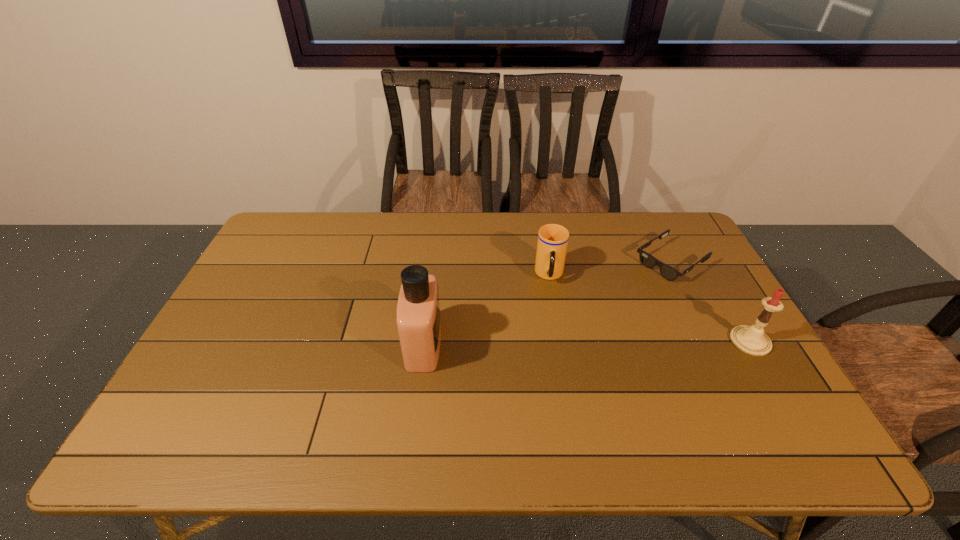
Identify the location of vacant space at the left edge of the desktop. (293, 257).

Where is `free space at the right edge of the desktop`? free space at the right edge of the desktop is located at coordinates (723, 316).

In the image, there is a desktop. Where is `vacant area at the far right corner`? This screenshot has width=960, height=540. vacant area at the far right corner is located at coordinates (674, 230).

Identify the location of vacant region between the leftmost object and the sunglasses. This screenshot has width=960, height=540. click(x=547, y=303).

This screenshot has width=960, height=540. I want to click on unoccupied area between the shortest object and the cup, so click(x=610, y=268).

You are a GUI agent. You are given a task and a screenshot of the screen. Output one action in this format:
    pyautogui.click(x=<x>, y=<y>)
    Task: Click on the blank region between the sunglasses and the third object from right to left
    This screenshot has width=960, height=540.
    Given the screenshot: What is the action you would take?
    pyautogui.click(x=610, y=268)

Where is `empty location between the cup and the shortest object`? empty location between the cup and the shortest object is located at coordinates (610, 268).

Image resolution: width=960 pixels, height=540 pixels. I want to click on unoccupied position between the candle and the leftmost object, so click(587, 343).

The height and width of the screenshot is (540, 960). I want to click on vacant area that lies between the candle and the shortest object, so click(x=710, y=301).

This screenshot has width=960, height=540. I want to click on empty space between the sunglasses and the second shortest object, so click(x=610, y=268).